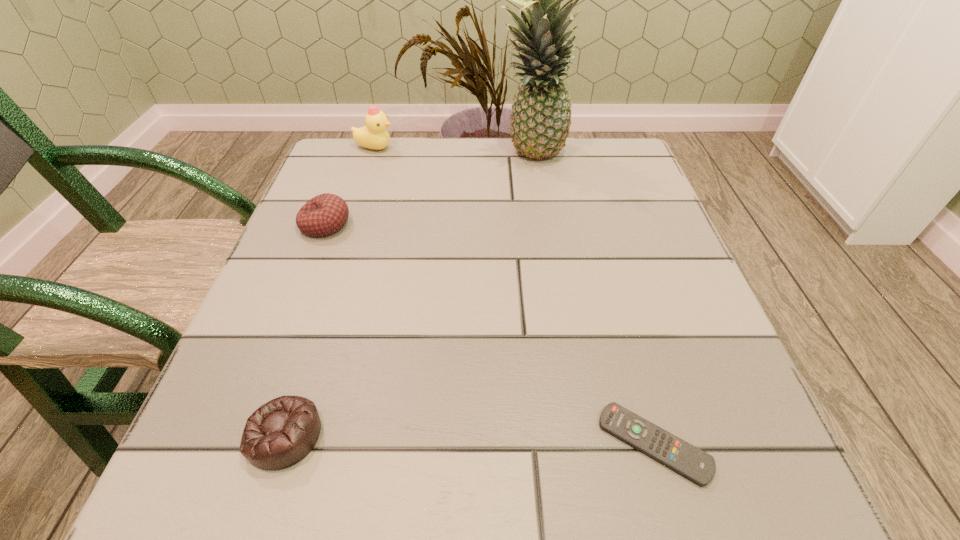
Find the location of a particular element. This screenshot has width=960, height=540. vacant area that lies between the pineapple and the shorter beanbag is located at coordinates (407, 295).

Find the location of a particular element. This screenshot has width=960, height=540. free area in between the shorter beanbag and the second tallest object is located at coordinates pyautogui.click(x=329, y=292).

This screenshot has width=960, height=540. Identify the location of vacant space in between the shorter beanbag and the remote control. (469, 439).

This screenshot has width=960, height=540. In order to click on unoccupied area between the tallest object and the farther beanbag in this screenshot , I will do coord(428,190).

This screenshot has width=960, height=540. In order to click on vacant point located between the farther beanbag and the shortest object in this screenshot , I will do `click(490, 334)`.

This screenshot has width=960, height=540. I want to click on free space between the shorter beanbag and the pineapple, so [407, 295].

This screenshot has width=960, height=540. In order to click on free space that is in between the pineapple and the shorter beanbag in this screenshot , I will do `click(407, 295)`.

The height and width of the screenshot is (540, 960). In order to click on vacant area that lies between the pineapple and the remote control in this screenshot , I will do `click(592, 300)`.

In order to click on the fourth closest object to the nearer beanbag in this screenshot , I will do `click(374, 135)`.

The height and width of the screenshot is (540, 960). I want to click on object that is the second nearest to the third nearest object, so click(x=541, y=115).